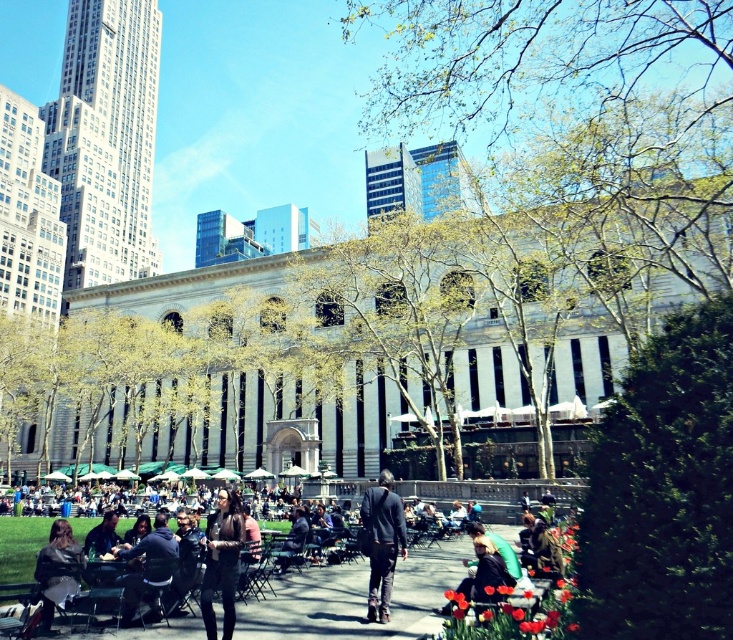
You are standing in the urban park scene described. There is a point marked at coordinates [380,541]. What object is located at this point?

The dark blue jeans at center are located at point [380,541].